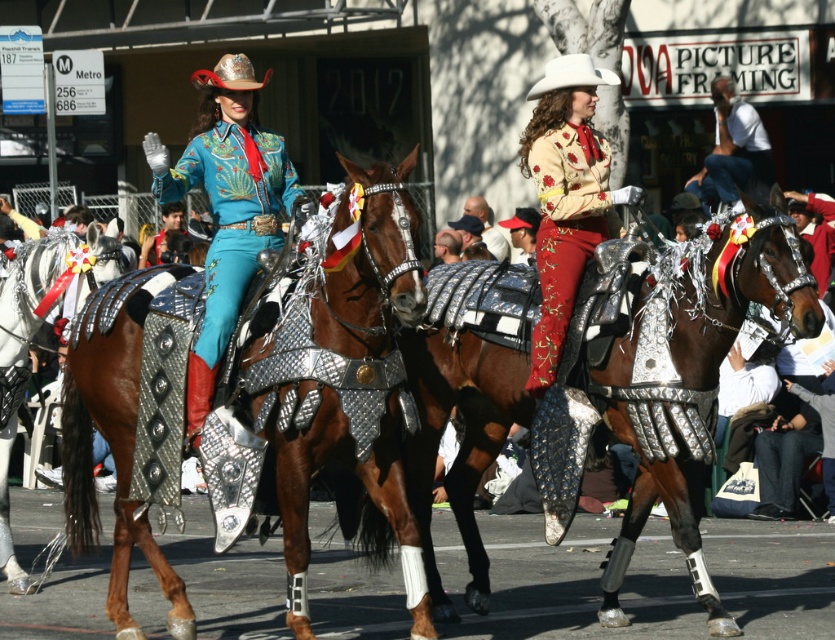
You are a photographer at the parade and want to capture both the matte teal fabric at center and the shiny metallic armor at center in a single shot. Which object should you focus on first to ensure both are in frame?

You should focus on the shiny metallic armor at center first since it is larger than the matte teal fabric at center, ensuring it fits within the frame while the smaller fabric can be positioned alongside.